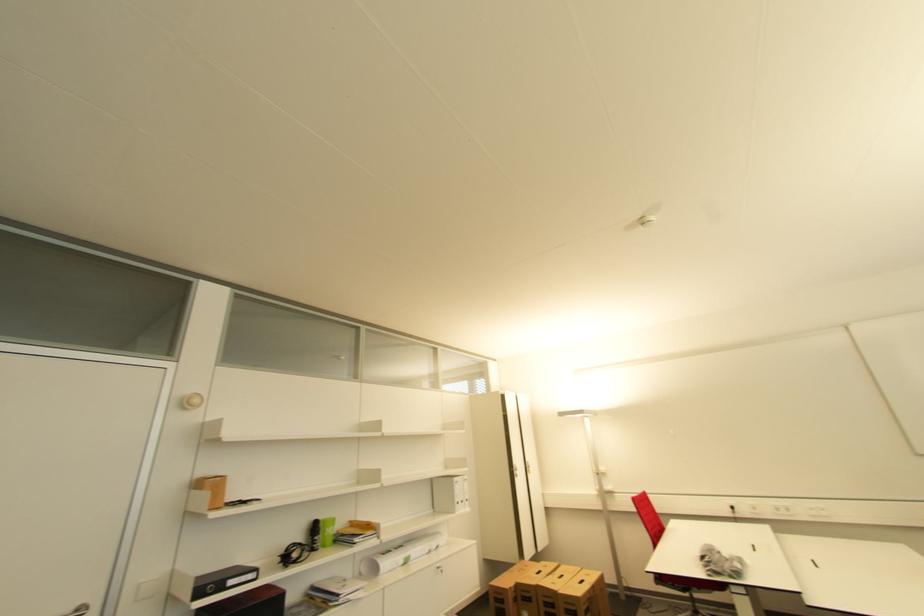
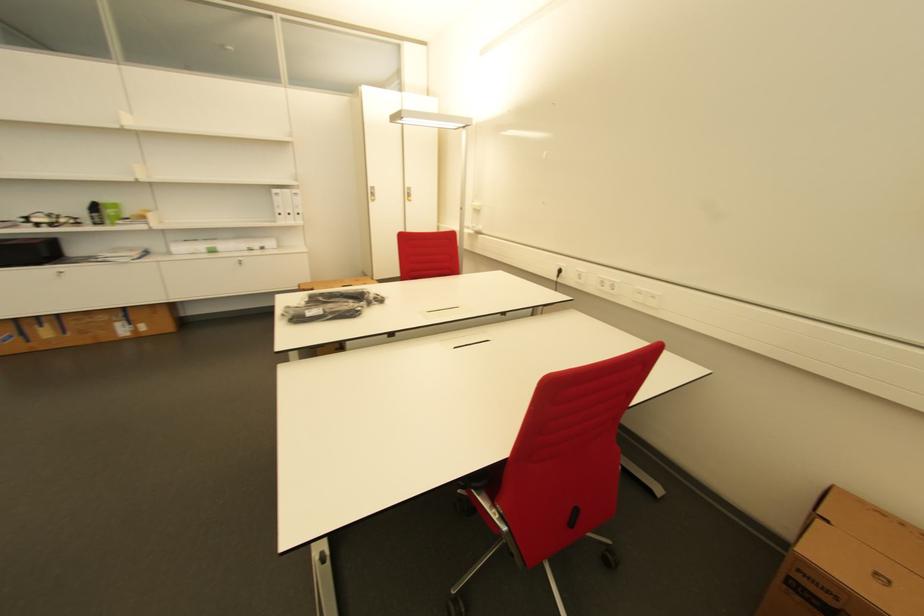
Find the pixel in the second image that matches [468,503] in the first image.

(294, 216)